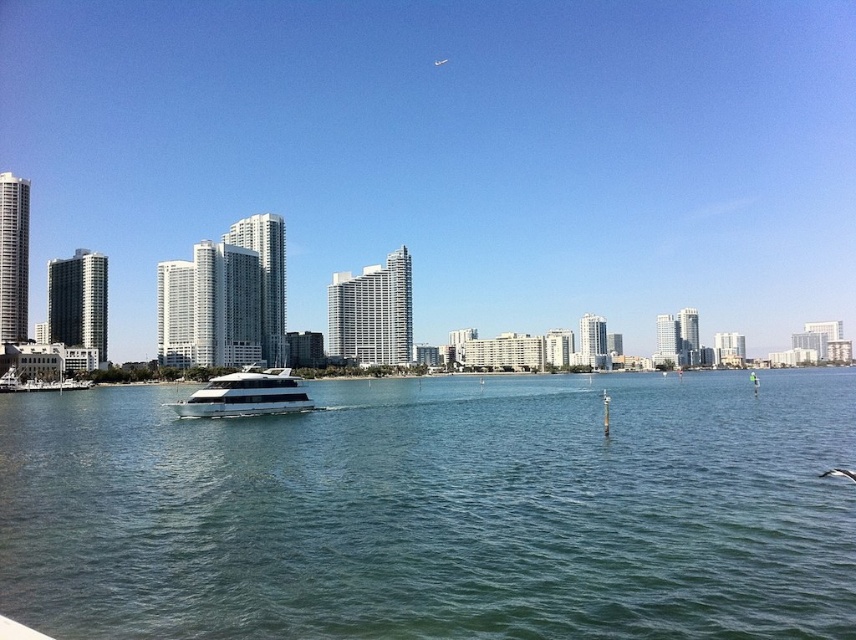
Question: Can you confirm if greenish-blue water at center is bigger than white glossy boat at center?

Choices:
 (A) yes
 (B) no

Answer: (A)

Question: Does greenish-blue water at center come in front of white glossy boat at center?

Choices:
 (A) yes
 (B) no

Answer: (A)

Question: Can you confirm if greenish-blue water at center is positioned to the right of white glossy boat at center?

Choices:
 (A) no
 (B) yes

Answer: (B)

Question: Which of the following is the closest to the observer?

Choices:
 (A) (220, 381)
 (B) (720, 428)

Answer: (B)

Question: Which object is closer to the camera taking this photo?

Choices:
 (A) white glossy boat at center
 (B) greenish-blue water at center

Answer: (B)

Question: Which object is farther from the camera taking this photo?

Choices:
 (A) white glossy boat at center
 (B) greenish-blue water at center

Answer: (A)